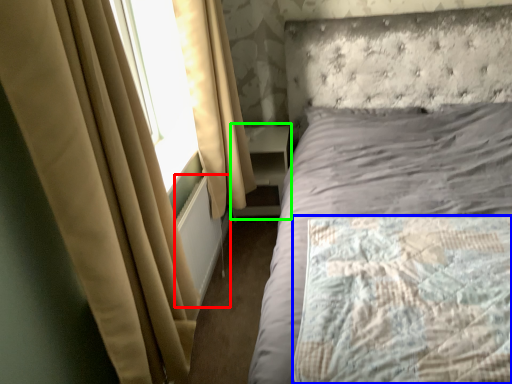
Question: Considering the real-world distances, which object is closest to radiator (highlighted by a red box)? mattress (highlighted by a blue box) or bookshelf (highlighted by a green box).

Choices:
 (A) mattress
 (B) bookshelf

Answer: (B)